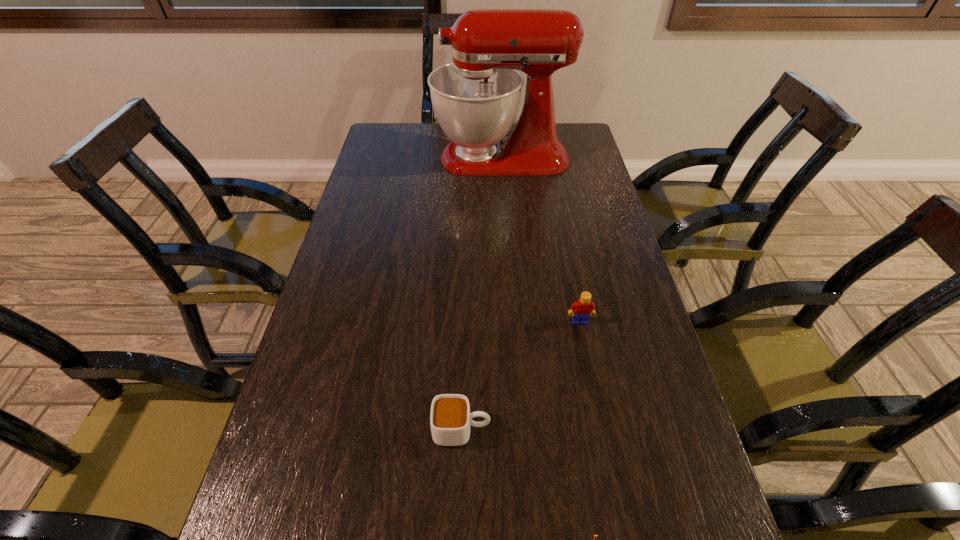
I want to click on free space between the mixer and the Lego, so click(540, 240).

Locate an element on the screen. The width and height of the screenshot is (960, 540). the closest object to the third shortest object is located at coordinates (450, 419).

Locate which object ranks second in proximity to the cup. Please provide its 2D coordinates. Your answer should be formatted as a tuple, i.e. [(x, y)], where the tuple contains the x and y coordinates of a point satisfying the conditions above.

[(583, 308)]

Locate an element on the screen. The width and height of the screenshot is (960, 540). vacant space that satisfies the following two spatial constraints: 1. on the face of the Lego; 2. on the side with the handle of the third farthest object is located at coordinates (601, 429).